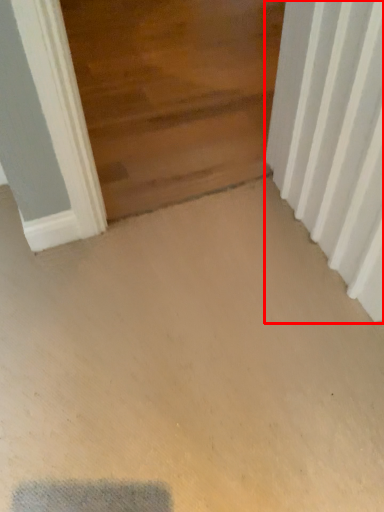
Question: From the image's perspective, what is the correct spatial relationship of radiator (annotated by the red box) in relation to door?

Choices:
 (A) below
 (B) above

Answer: (A)